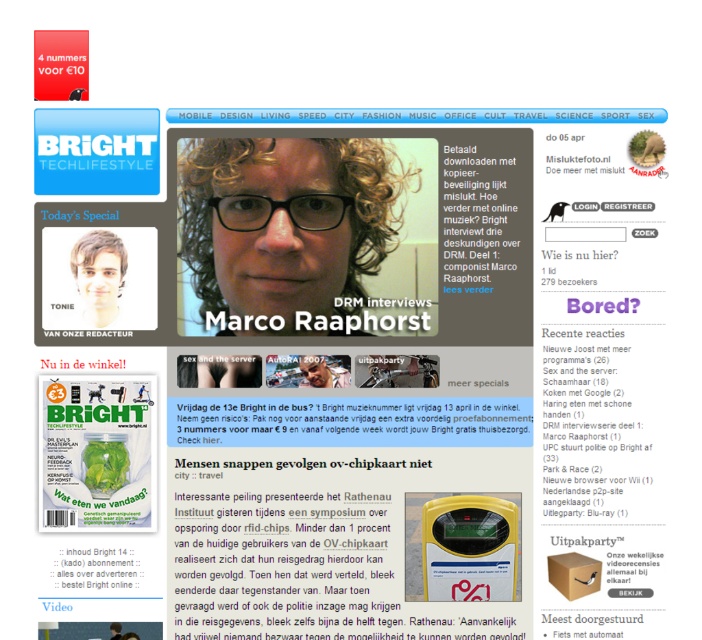
Measure the distance between curly hair at center and camera.

curly hair at center is 4.17 feet away from camera.

Based on the photo, can you confirm if curly hair at center is positioned to the right of black paper text at center?

In fact, curly hair at center is to the left of black paper text at center.

Does point (206, 168) come behind point (517, 218)?

No, (206, 168) is in front of (517, 218).

Image resolution: width=702 pixels, height=640 pixels. I want to click on curly hair at center, so tap(286, 227).

Is matte black headshot at upper left below black paper at lower left?

Actually, matte black headshot at upper left is above black paper at lower left.

Measure the distance between point (88, 262) and camera.

The distance of point (88, 262) from camera is 4.16 feet.

Image resolution: width=702 pixels, height=640 pixels. I want to click on matte black headshot at upper left, so click(98, 275).

Where is `matte black headshot at upper left`? This screenshot has height=640, width=702. matte black headshot at upper left is located at coordinates (98, 275).

Which of these two, green plastic bag at center or matte black glasses at center, stands shorter?

matte black glasses at center

Between green plastic bag at center and matte black glasses at center, which one appears on the right side from the viewer's perspective?

Positioned to the right is green plastic bag at center.

Image resolution: width=702 pixels, height=640 pixels. What do you see at coordinates (350, 420) in the screenshot?
I see `green plastic bag at center` at bounding box center [350, 420].

Where is `green plastic bag at center`? green plastic bag at center is located at coordinates (350, 420).